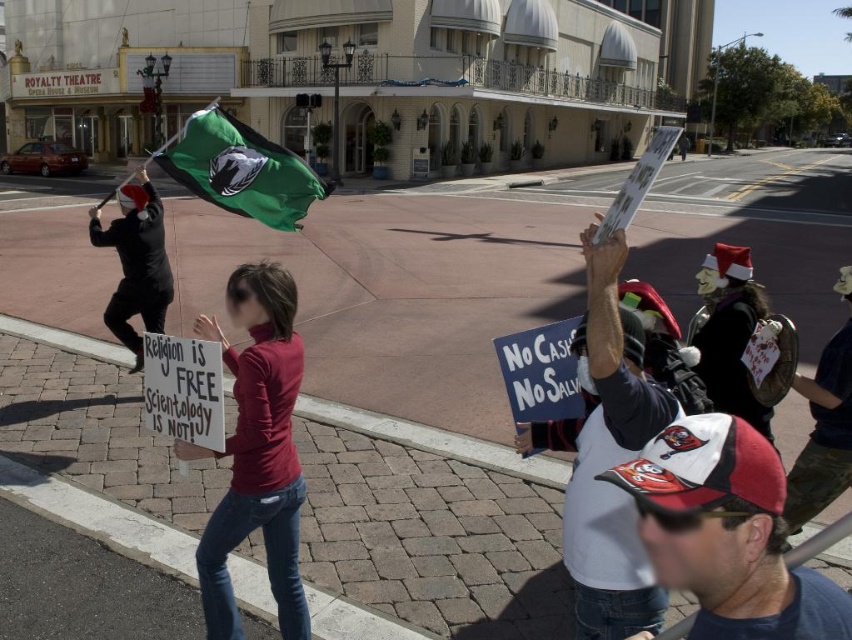
You are a photographer standing in front of the ROYALTY THEATRE and want to capture both the green fabric flag at upper left and the black matte flag at left in your photo. Which flag is higher up in the frame?

The green fabric flag at upper left is positioned over the black matte flag at left, meaning it is higher up in the frame.